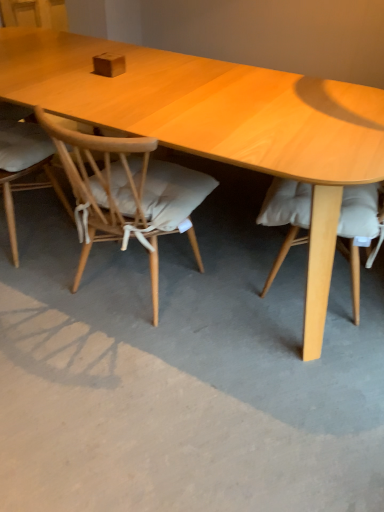
Locate an element on the screen. This screenshot has width=384, height=512. light brown wood chair at left, which is the second chair in right-to-left order is located at coordinates (24, 167).

You are a GUI agent. You are given a task and a screenshot of the screen. Output one action in this format:
    pyautogui.click(x=<x>, y=<y>)
    Task: Click on the light wood chair at center, the 1th chair viewed from the right
    
    Given the screenshot: What is the action you would take?
    pyautogui.click(x=127, y=193)

Where is `gray concrete at center`? The height and width of the screenshot is (512, 384). gray concrete at center is located at coordinates (182, 375).

In the scene shown: Can you tell me how much light wood chair at center, the second chair viewed from the left, and light brown wood chair at left, the first chair viewed from the left, differ in facing direction?

0.000134 degrees.

Considering the positions of points (39, 120) and (7, 223), is point (39, 120) closer to camera compared to point (7, 223)?

Yes, it is.

Would you say light wood chair at center, the second chair viewed from the left, is inside or outside light brown wood chair at left, the first chair viewed from the left?

light wood chair at center, the second chair viewed from the left, lies outside light brown wood chair at left, the first chair viewed from the left.

Is light brown wood chair at left, the first chair viewed from the left, positioned in front of light wood chair at center, the second chair viewed from the left?

No, light brown wood chair at left, the first chair viewed from the left, is further to the viewer.

Considering the positions of point (24, 186) and point (52, 127), is point (24, 186) closer or farther from the camera than point (52, 127)?

Clearly, point (24, 186) is more distant from the camera than point (52, 127).

Are light brown wood chair at left, the first chair viewed from the left, and light wood chair at center, the 1th chair viewed from the right, far apart?

No, there isn't a large distance between light brown wood chair at left, the first chair viewed from the left, and light wood chair at center, the 1th chair viewed from the right.

Which is closer to the camera, (36, 137) or (282, 374)?

The point (282, 374) is closer to the camera.

From a real-world perspective, is light brown wood chair at left, the first chair viewed from the left, over gray concrete at center?

Correct, in the physical world, light brown wood chair at left, the first chair viewed from the left, is higher than gray concrete at center.

Considering the sizes of objects light brown wood chair at left, which is the second chair in right-to-left order, and gray concrete at center in the image provided, who is bigger, light brown wood chair at left, which is the second chair in right-to-left order, or gray concrete at center?

Bigger between the two is light brown wood chair at left, which is the second chair in right-to-left order.

Is light brown wood chair at left, which is the second chair in right-to-left order, taller or shorter than gray concrete at center?

Clearly, light brown wood chair at left, which is the second chair in right-to-left order, is taller compared to gray concrete at center.

Locate an element on the screen. Image resolution: width=384 pixels, height=512 pixels. concrete in front of the light wood chair at center, the second chair viewed from the left is located at coordinates (182, 375).

Considering the relative positions of gray concrete at center and light wood chair at center, the 1th chair viewed from the right, in the image provided, is gray concrete at center to the left or to the right of light wood chair at center, the 1th chair viewed from the right,?

gray concrete at center is to the right of light wood chair at center, the 1th chair viewed from the right.

Are gray concrete at center and light wood chair at center, the second chair viewed from the left, making contact?

No, gray concrete at center is not touching light wood chair at center, the second chair viewed from the left.

From a real-world perspective, between gray concrete at center and light wood chair at center, the 1th chair viewed from the right, who is vertically lower?

gray concrete at center.

Is light wood chair at center, the 1th chair viewed from the right, oriented towards gray concrete at center?

No, light wood chair at center, the 1th chair viewed from the right, is not facing towards gray concrete at center.

Measure the distance from light wood chair at center, the second chair viewed from the left, to gray concrete at center.

light wood chair at center, the second chair viewed from the left, is 16.66 inches from gray concrete at center.

From a real-world perspective, who is located lower, light wood chair at center, the 1th chair viewed from the right, or gray concrete at center?

gray concrete at center, from a real-world perspective.

Find the location of a particular element. This screenshot has height=512, width=384. concrete below the light wood chair at center, the second chair viewed from the left (from a real-world perspective) is located at coordinates (182, 375).

From a real-world perspective, which is physically above, gray concrete at center or light brown wood chair at left, which is the second chair in right-to-left order?

light brown wood chair at left, which is the second chair in right-to-left order, from a real-world perspective.

Is light brown wood chair at left, which is the second chair in right-to-left order, at the back of gray concrete at center?

No, gray concrete at center is not facing the opposite direction of light brown wood chair at left, which is the second chair in right-to-left order.

Considering the points (41, 213) and (45, 155), which point is behind, point (41, 213) or point (45, 155)?

The point (41, 213) is farther from the camera.

Is gray concrete at center not near light brown wood chair at left, the first chair viewed from the left?

No, gray concrete at center is not far from light brown wood chair at left, the first chair viewed from the left.

What are the coordinates of `chair above the light wood chair at center, the 1th chair viewed from the right (from the image's perspective)` in the screenshot? It's located at (24, 167).

Where is `chair that is behind the light wood chair at center, the second chair viewed from the left`? The image size is (384, 512). chair that is behind the light wood chair at center, the second chair viewed from the left is located at coordinates (24, 167).

When comparing their distances from gray concrete at center, does light wood chair at center, the 1th chair viewed from the right, or light brown wood chair at left, the first chair viewed from the left, seem closer?

light wood chair at center, the 1th chair viewed from the right, is closer to gray concrete at center.

Which object lies further to the anchor point light brown wood chair at left, which is the second chair in right-to-left order, light wood chair at center, the 1th chair viewed from the right, or gray concrete at center?

Among the two, gray concrete at center is located further to light brown wood chair at left, which is the second chair in right-to-left order.

Based on their spatial positions, is gray concrete at center or light wood chair at center, the second chair viewed from the left, closer to light brown wood chair at left, the first chair viewed from the left?

light wood chair at center, the second chair viewed from the left.

Considering their positions, is gray concrete at center positioned further to light wood chair at center, the 1th chair viewed from the right, than light brown wood chair at left, the first chair viewed from the left?

light brown wood chair at left, the first chair viewed from the left, lies further to light wood chair at center, the 1th chair viewed from the right, than the other object.

Looking at the image, which one is located closer to gray concrete at center, light brown wood chair at left, which is the second chair in right-to-left order, or light wood chair at center, the second chair viewed from the left?

Among the two, light wood chair at center, the second chair viewed from the left, is located nearer to gray concrete at center.

Based on their spatial positions, is light brown wood chair at left, which is the second chair in right-to-left order, or gray concrete at center further from light wood chair at center, the 1th chair viewed from the right?

Among the two, light brown wood chair at left, which is the second chair in right-to-left order, is located further to light wood chair at center, the 1th chair viewed from the right.

You are a GUI agent. You are given a task and a screenshot of the screen. Output one action in this format:
    pyautogui.click(x=<x>, y=<y>)
    Task: Click on the chair between light brown wood chair at left, the first chair viewed from the left, and gray concrete at center from left to right
    
    Given the screenshot: What is the action you would take?
    pyautogui.click(x=127, y=193)